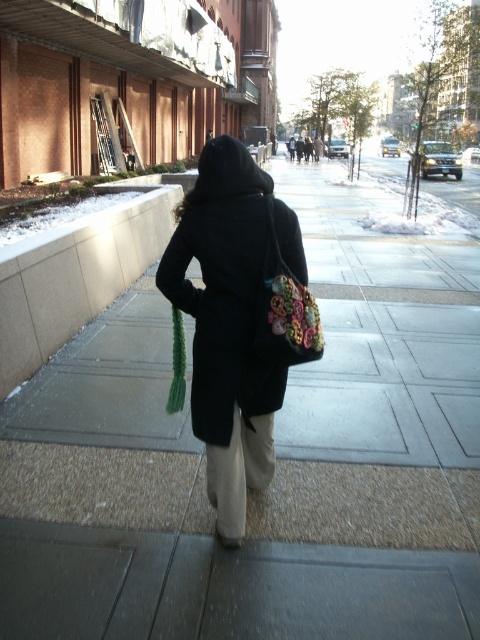
You are a delivery person who needs to carry an additional package. The package is the same size as the floral fabric bag at back. Can you fit it under the black matte coat at center without adjusting the coat?

The black matte coat at center has a larger size compared to the floral fabric bag at back, so the package can fit under the black matte coat at center without needing adjustments.

You are a fashion designer observing a person on a city sidewalk. You notice the black matte coat at center and the floral fabric bag at back. Which item is positioned higher on the person?

The black matte coat at center is taller than the floral fabric bag at back, so the black matte coat at center is positioned higher on the person.